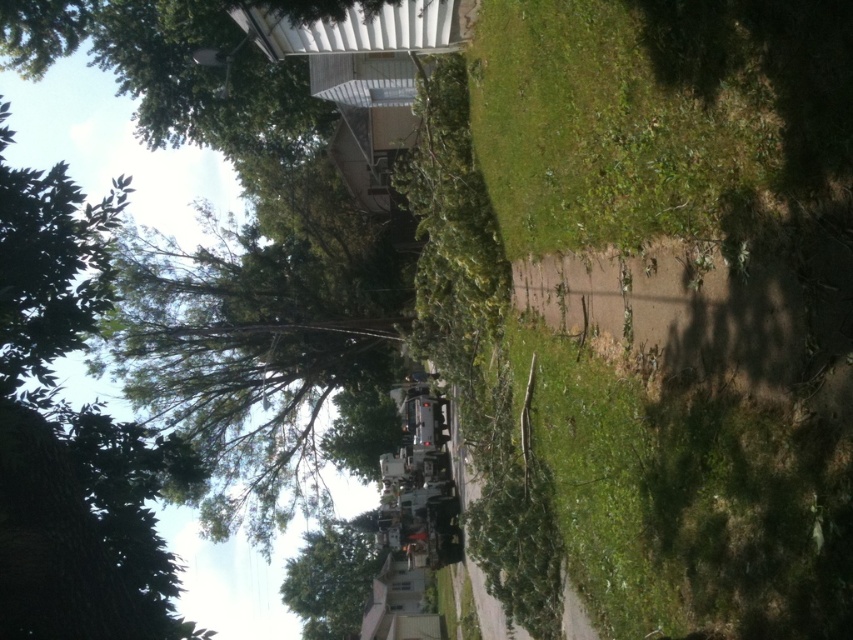
Question: Which of the following is the farthest from the observer?

Choices:
 (A) green leafy tree at upper left
 (B) green leafy tree at lower center
 (C) green grass at center

Answer: (B)

Question: Can you confirm if green leafy tree at upper left is positioned above green leafy tree at lower center?

Choices:
 (A) yes
 (B) no

Answer: (A)

Question: Which point is farther to the camera?

Choices:
 (A) (383, 348)
 (B) (326, 580)

Answer: (B)

Question: Which object appears farthest from the camera in this image?

Choices:
 (A) green leafy tree at upper left
 (B) green leafy tree at lower center

Answer: (B)

Question: Can you confirm if green leafy tree at upper left is smaller than green leafy tree at lower center?

Choices:
 (A) no
 (B) yes

Answer: (A)

Question: In this image, where is green grass at center located relative to green leafy tree at lower center?

Choices:
 (A) below
 (B) above

Answer: (B)